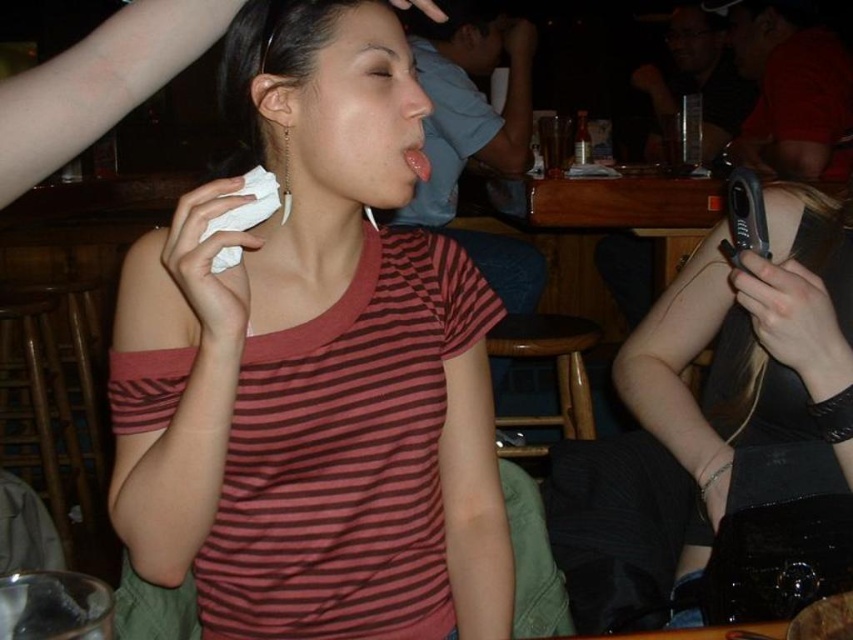
Question: Among these objects, which one is farthest from the camera?

Choices:
 (A) matte skin nose at center
 (B) pink glossy tongue at center
 (C) striped cotton shirt at center

Answer: (B)

Question: Where is striped cotton shirt at center located in relation to black matte phone at right in the image?

Choices:
 (A) right
 (B) left

Answer: (B)

Question: Which point appears farthest from the camera in this image?

Choices:
 (A) (834, 337)
 (B) (419, 170)

Answer: (A)

Question: Where is matte black phone at center located in relation to matte black phone at upper center in the image?

Choices:
 (A) below
 (B) above

Answer: (A)

Question: Does black matte phone at right appear over matte skin nose at center?

Choices:
 (A) no
 (B) yes

Answer: (A)

Question: Which of these objects is positioned closest to the pink glossy tongue at center?

Choices:
 (A) striped cotton shirt at center
 (B) matte black phone at center
 (C) matte skin nose at center
 (D) matte black phone at upper center

Answer: (C)